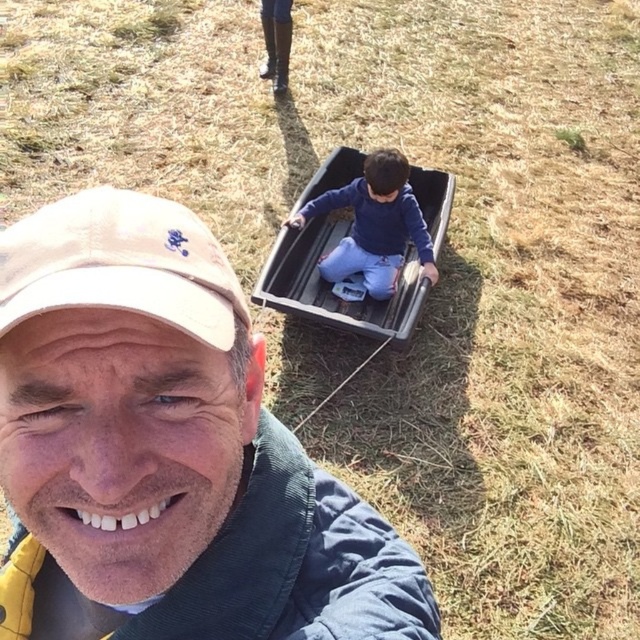
Question: Can you confirm if beige fabric cap at upper left is positioned above black plastic wagon at center?

Choices:
 (A) no
 (B) yes

Answer: (A)

Question: Does matte khaki cap at upper left have a lesser width compared to black plastic wagon at center?

Choices:
 (A) no
 (B) yes

Answer: (B)

Question: Where is matte khaki cap at upper left located in relation to black plastic wagon at center in the image?

Choices:
 (A) above
 (B) below

Answer: (B)

Question: Which is nearer to the matte khaki cap at upper left?

Choices:
 (A) black plastic wagon at center
 (B) beige fabric cap at upper left

Answer: (B)

Question: Which of the following is the farthest from the observer?

Choices:
 (A) (152, 284)
 (B) (310, 228)

Answer: (B)

Question: Considering the real-world distances, which object is farthest from the beige fabric cap at upper left?

Choices:
 (A) matte khaki cap at upper left
 (B) black plastic wagon at center

Answer: (B)